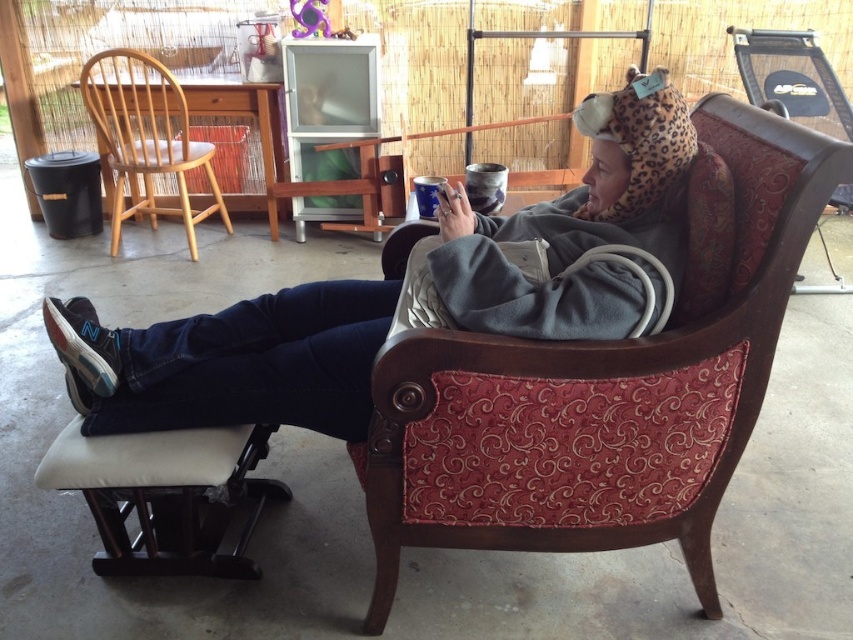
You are a delivery robot that needs to place a package between the gray fleece blanket at upper right and the light wood chair at left. The package is 3 feet wide. Can you fit the package in the space between them?

The gray fleece blanket at upper right and light wood chair at left are 6.60 feet apart from each other. Since the package is 3 feet wide, it can be placed in the space between them as there is enough room.